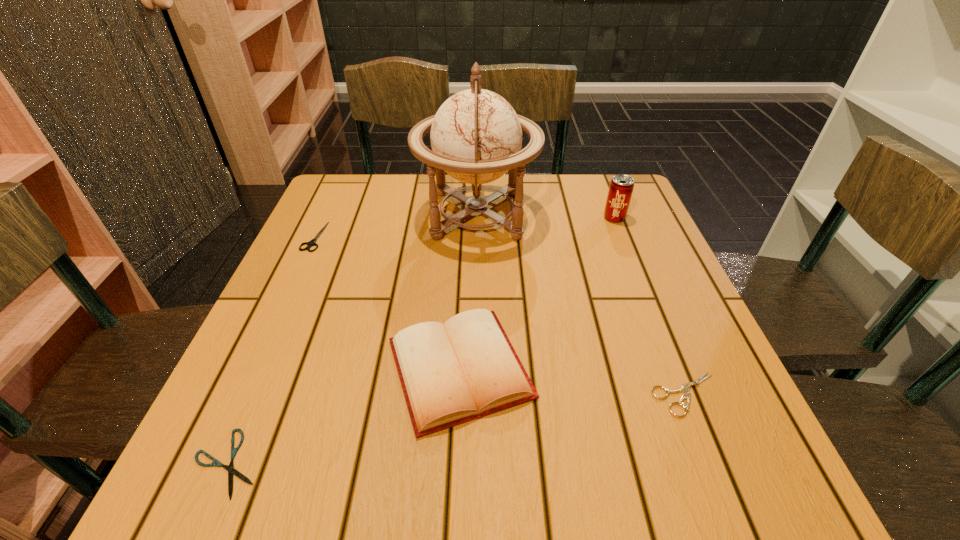
The height and width of the screenshot is (540, 960). I want to click on globe, so click(476, 136).

Locate an element on the screen. This screenshot has height=540, width=960. the second tallest object is located at coordinates (621, 187).

What are the coordinates of `Bible` in the screenshot? It's located at (451, 373).

Locate an element on the screen. the farthest shears is located at coordinates (312, 242).

This screenshot has width=960, height=540. What are the coordinates of `the fourth tallest object` in the screenshot? It's located at (312, 242).

This screenshot has height=540, width=960. Identify the location of the second farthest shears. (685, 388).

Locate an element on the screen. Image resolution: width=960 pixels, height=540 pixels. the rightmost shears is located at coordinates (685, 388).

Find the location of a particular element. the nearest shears is located at coordinates (230, 468).

Locate an element on the screen. The width and height of the screenshot is (960, 540). the shortest object is located at coordinates (230, 468).

The height and width of the screenshot is (540, 960). In order to click on vacant region located at the front of the tallest object showing Africa in this screenshot , I will do coord(642,215).